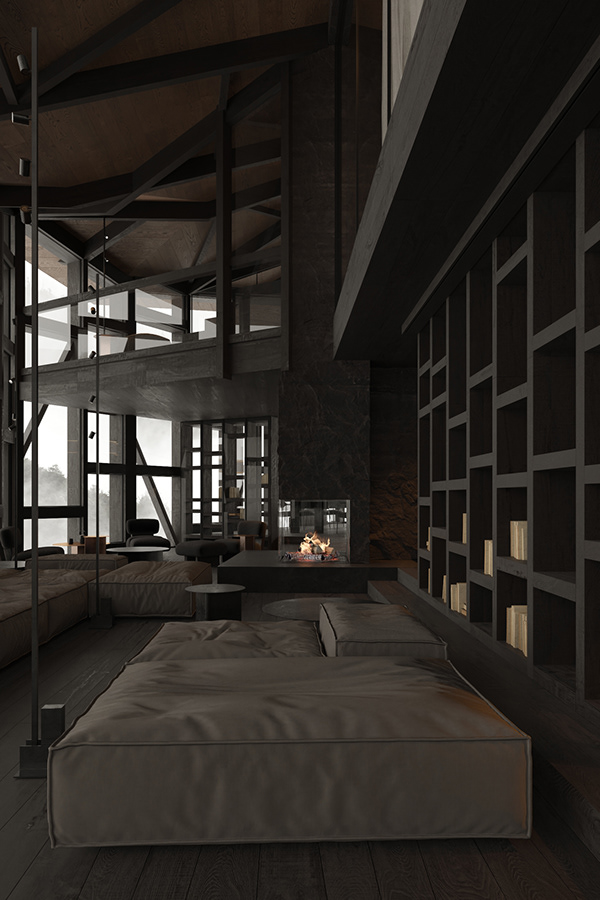
This screenshot has height=900, width=600. Identify the location of books. (516, 627), (458, 597), (488, 555), (527, 536), (466, 534), (427, 545), (428, 585), (444, 595), (234, 488).